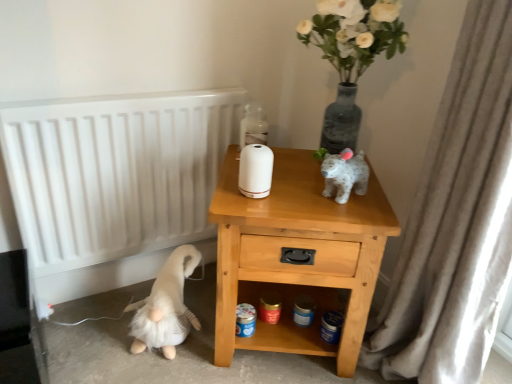
Question: Could you tell me if translucent glass bottle at upper center is facing light wood/texture nightstand at center?

Choices:
 (A) yes
 (B) no

Answer: (B)

Question: From the image's perspective, does translucent glass bottle at upper center appear higher than light wood/texture nightstand at center?

Choices:
 (A) yes
 (B) no

Answer: (A)

Question: Considering the relative sizes of translucent glass bottle at upper center and light wood/texture nightstand at center in the image provided, is translucent glass bottle at upper center wider than light wood/texture nightstand at center?

Choices:
 (A) no
 (B) yes

Answer: (A)

Question: Considering the relative sizes of translucent glass bottle at upper center and light wood/texture nightstand at center in the image provided, is translucent glass bottle at upper center bigger than light wood/texture nightstand at center?

Choices:
 (A) no
 (B) yes

Answer: (A)

Question: Is translucent glass bottle at upper center at the left side of light wood/texture nightstand at center?

Choices:
 (A) yes
 (B) no

Answer: (A)

Question: Considering the positions of light wood/texture nightstand at center and white textured curtain at right in the image, is light wood/texture nightstand at center taller or shorter than white textured curtain at right?

Choices:
 (A) short
 (B) tall

Answer: (A)

Question: Would you say light wood/texture nightstand at center is to the left or to the right of white textured curtain at right in the picture?

Choices:
 (A) right
 (B) left

Answer: (B)

Question: Considering the positions of point [297, 190] and point [471, 302], is point [297, 190] closer or farther from the camera than point [471, 302]?

Choices:
 (A) closer
 (B) farther

Answer: (B)

Question: Is light wood/texture nightstand at center spatially inside white textured curtain at right, or outside of it?

Choices:
 (A) inside
 (B) outside

Answer: (B)

Question: From the image's perspective, is translucent glass bottle at upper center positioned above or below white textured curtain at right?

Choices:
 (A) below
 (B) above

Answer: (B)

Question: Considering their positions, is translucent glass bottle at upper center located in front of or behind white textured curtain at right?

Choices:
 (A) front
 (B) behind

Answer: (B)

Question: Considering the positions of translucent glass bottle at upper center and white textured curtain at right in the image, is translucent glass bottle at upper center taller or shorter than white textured curtain at right?

Choices:
 (A) short
 (B) tall

Answer: (A)

Question: In terms of width, does translucent glass bottle at upper center look wider or thinner when compared to white textured curtain at right?

Choices:
 (A) wide
 (B) thin

Answer: (B)

Question: Considering their positions, is translucent glass bottle at upper center located in front of or behind light wood/texture nightstand at center?

Choices:
 (A) front
 (B) behind

Answer: (B)

Question: Looking at the image, does translucent glass bottle at upper center seem bigger or smaller compared to light wood/texture nightstand at center?

Choices:
 (A) big
 (B) small

Answer: (B)